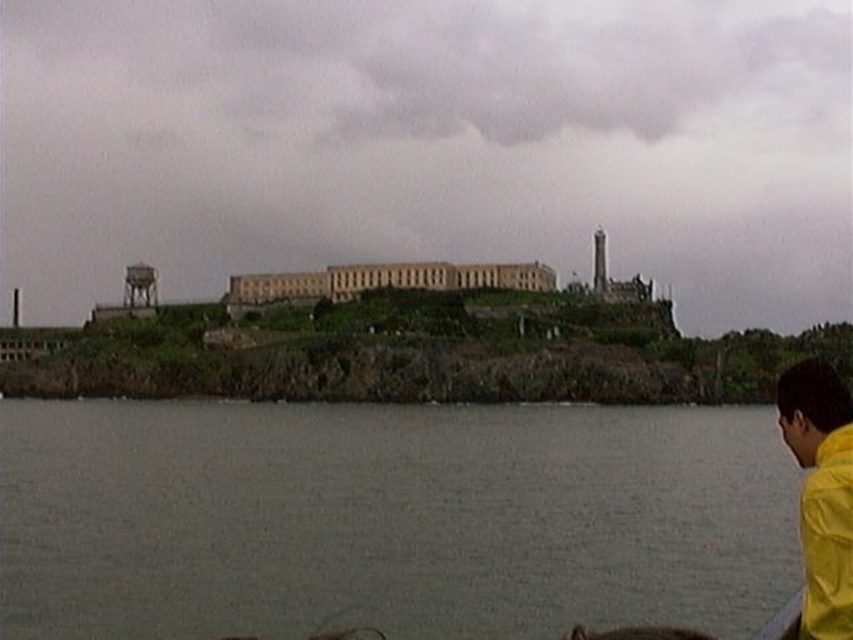
Question: Which of the following is the closest to the observer?

Choices:
 (A) (62, 474)
 (B) (817, 419)

Answer: (B)

Question: Is gray water at lower center above yellow matte jacket at lower right?

Choices:
 (A) no
 (B) yes

Answer: (A)

Question: Can you confirm if gray water at lower center is bigger than yellow matte jacket at lower right?

Choices:
 (A) no
 (B) yes

Answer: (A)

Question: Which object is closer to the camera taking this photo?

Choices:
 (A) yellow matte jacket at lower right
 (B) gray water at lower center

Answer: (A)

Question: Which object is farther from the camera taking this photo?

Choices:
 (A) gray water at lower center
 (B) yellow matte jacket at lower right

Answer: (A)

Question: Is gray water at lower center thinner than yellow matte jacket at lower right?

Choices:
 (A) yes
 (B) no

Answer: (B)